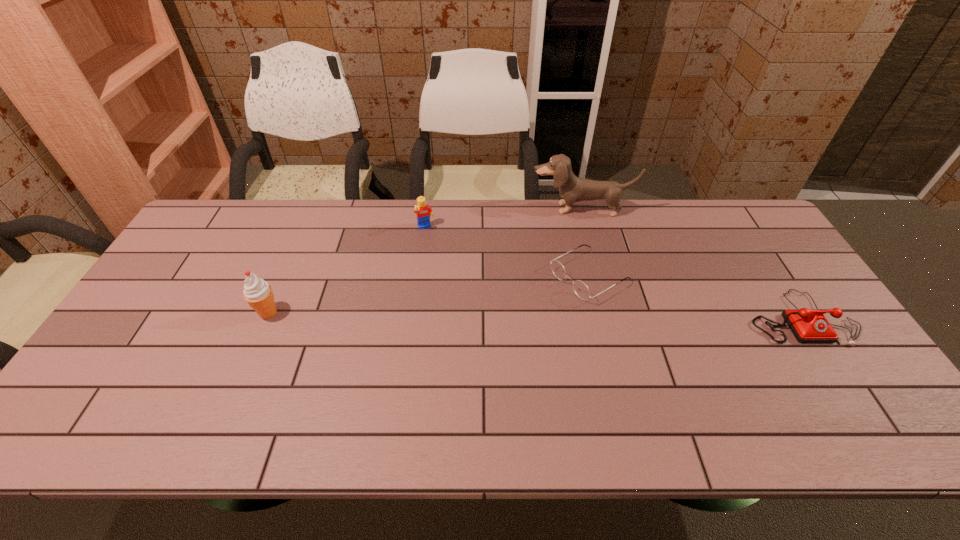
This screenshot has height=540, width=960. Find the location of `Lego present at the far edge`. Lego present at the far edge is located at coordinates (423, 212).

At what (x,y) coordinates should I click in order to perform the action: click on puppy that is positioned at the far edge. Please return your answer as a coordinate pair (x, y). This screenshot has height=540, width=960. Looking at the image, I should click on (572, 189).

Locate an element on the screen. object located at the right edge is located at coordinates coord(807,325).

Identify the location of blank space at the far edge of the desktop. (642, 215).

Where is `vacant area at the near edge of the desktop`? vacant area at the near edge of the desktop is located at coordinates (313, 373).

Find the location of a particular element. The height and width of the screenshot is (540, 960). vacant space at the right edge of the desktop is located at coordinates (800, 307).

Locate an element on the screen. The width and height of the screenshot is (960, 540). free space at the far left corner is located at coordinates (226, 239).

The height and width of the screenshot is (540, 960). What are the coordinates of `free location at the far right corner` in the screenshot? It's located at (756, 231).

The width and height of the screenshot is (960, 540). What are the coordinates of `empty space between the spectacles and the farthest object` in the screenshot? It's located at (585, 242).

Where is `free space between the rightmost object and the second farthest object`? The width and height of the screenshot is (960, 540). free space between the rightmost object and the second farthest object is located at coordinates (612, 273).